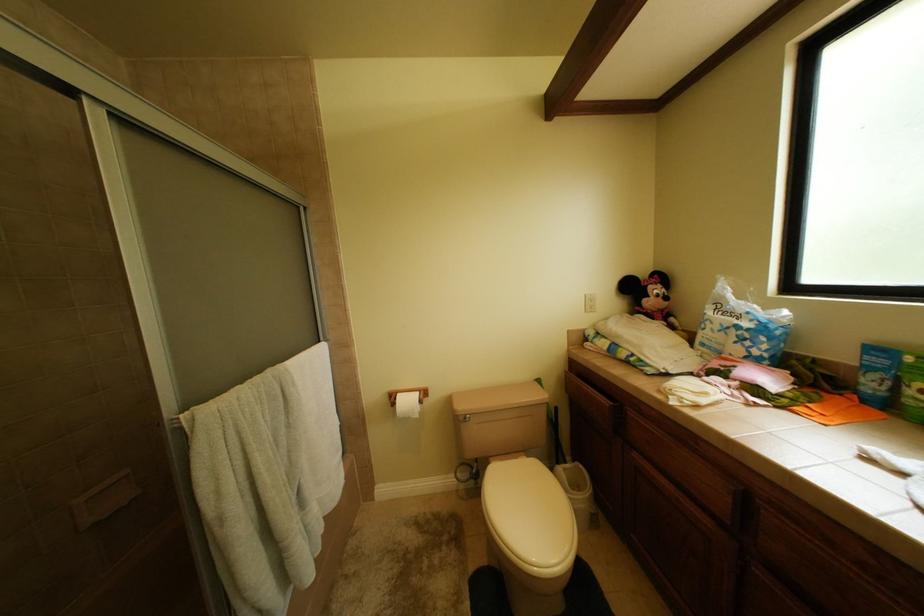
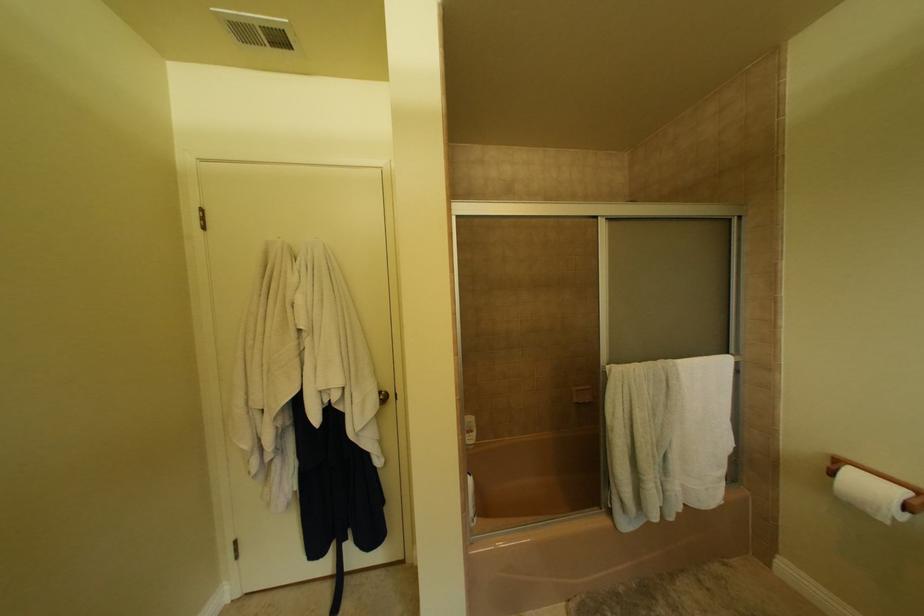
Question: The images are taken continuously from a first-person perspective. In which direction is your viewpoint rotating?

Choices:
 (A) Left
 (B) Right
 (C) Up
 (D) Down

Answer: (A)